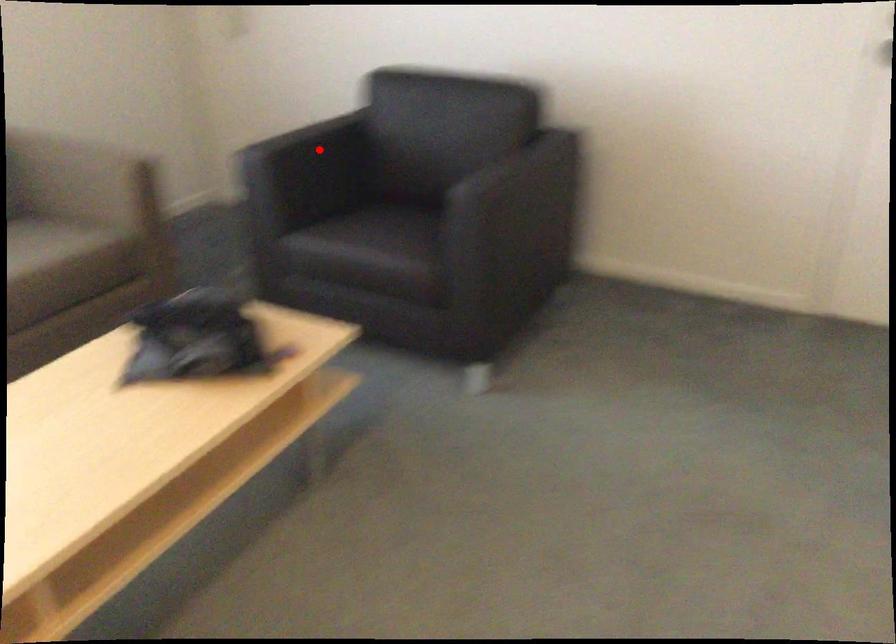
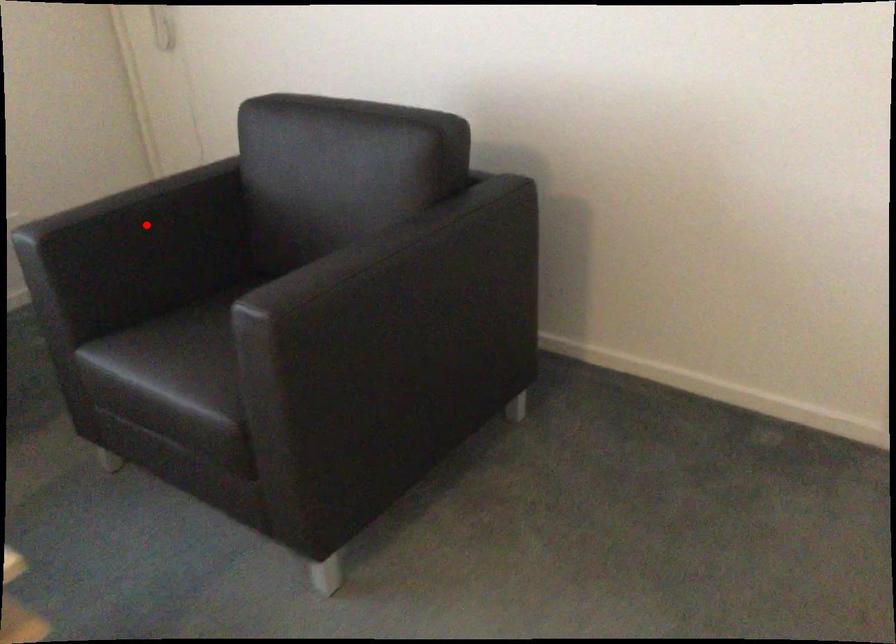
I am providing you with two images of the same scene from different viewpoints. A red point is marked on the first image and another point is marked on the second image. Is the marked point in image1 the same physical position as the marked point in image2?

Yes